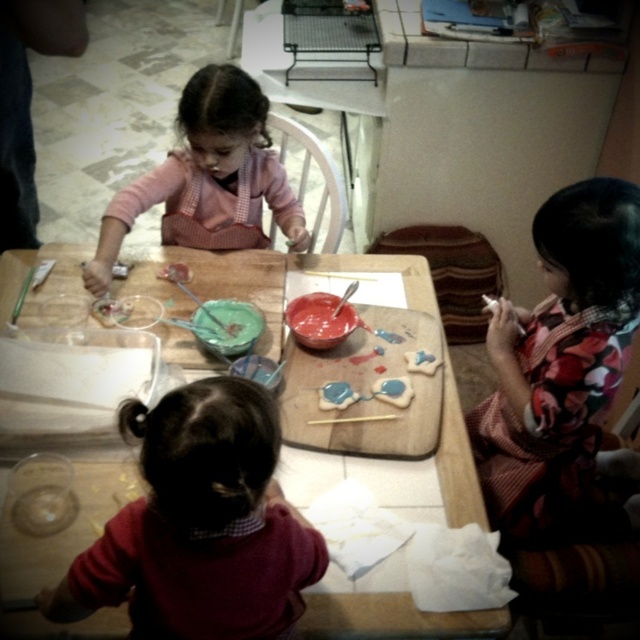
Question: Where is smooth glossy red paint at center located in relation to matte green plastic plate at center in the image?

Choices:
 (A) below
 (B) above

Answer: (B)

Question: Which point appears farthest from the camera in this image?

Choices:
 (A) (449, 464)
 (B) (227, 180)
 (C) (552, 384)

Answer: (B)

Question: Among these points, which one is nearest to the camera?

Choices:
 (A) (536, 472)
 (B) (259, 330)

Answer: (A)

Question: Considering the real-world distances, which object is farthest from the matte green plastic plate at center?

Choices:
 (A) pink fabric dress at upper left
 (B) maroon sweater at lower left

Answer: (B)

Question: Is pink fabric dress at upper left bigger than smooth glossy red paint at center?

Choices:
 (A) yes
 (B) no

Answer: (A)

Question: Is floral fabric shirt at right positioned in front of matte green plastic plate at center?

Choices:
 (A) no
 (B) yes

Answer: (B)